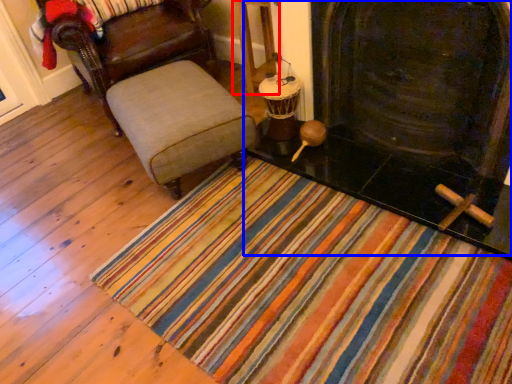
Question: Which point is further to the camera, table (highlighted by a red box) or fireplace (highlighted by a blue box)?

Choices:
 (A) table
 (B) fireplace

Answer: (A)